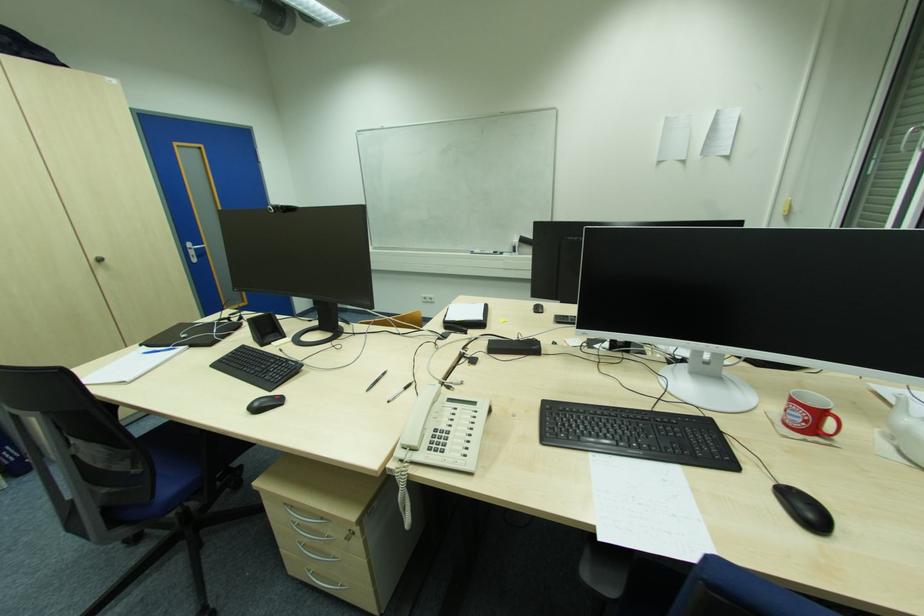
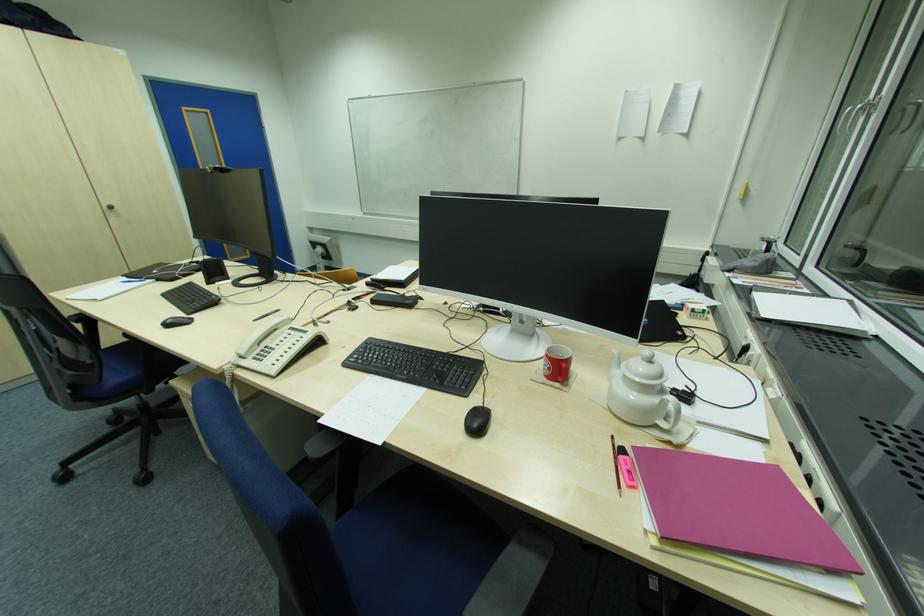
Question: I am providing you with two images of the same scene from different viewpoints. Which of the following objects are not visible in image2?

Choices:
 (A) white teapot handle
 (B) black chair sitting surface
 (C) blue chair sitting surface
 (D) none of these

Answer: (D)